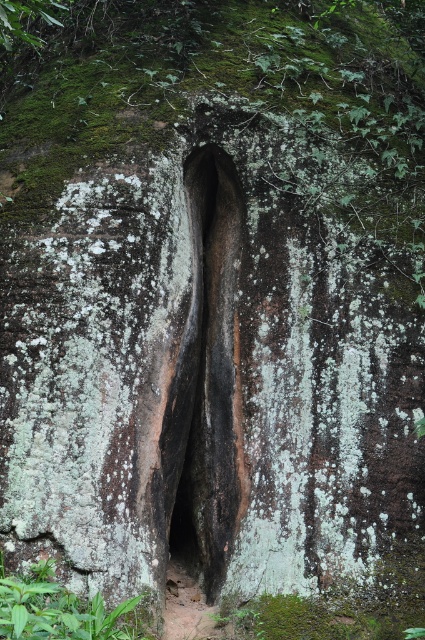
What do you see at coordinates (231, 97) in the screenshot? This screenshot has width=425, height=640. I see `green mossy leaves at center` at bounding box center [231, 97].

Which is in front, point (215, 44) or point (209, 224)?

Positioned in front is point (215, 44).

Identify the location of green mossy leaves at center. The width and height of the screenshot is (425, 640). (231, 97).

Can you confirm if black rock cave at center is thinner than green leafy plant at lower left?

Yes.

Can you confirm if black rock cave at center is positioned to the right of green leafy plant at lower left?

Correct, you'll find black rock cave at center to the right of green leafy plant at lower left.

Which is in front, point (212, 358) or point (3, 605)?

Point (3, 605) is more forward.

Where is `black rock cave at center`? black rock cave at center is located at coordinates (207, 378).

Can you confirm if green mossy leaves at center is positioned below green leafy plant at lower left?

Incorrect, green mossy leaves at center is not positioned below green leafy plant at lower left.

This screenshot has height=640, width=425. I want to click on green mossy leaves at center, so click(231, 97).